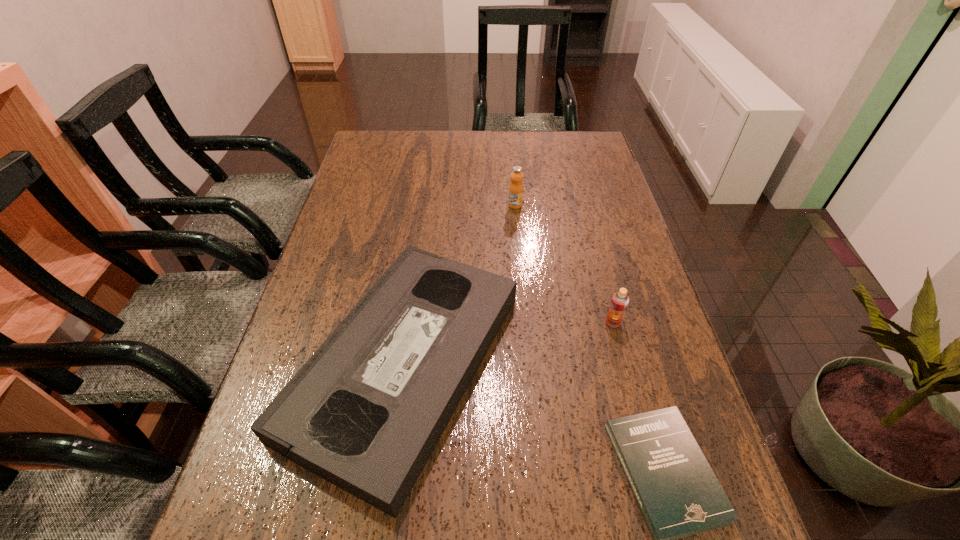
You are a GUI agent. You are given a task and a screenshot of the screen. Output one action in this format:
    pyautogui.click(x=<x>, y=<y>)
    Task: Click on the vacant space that satisfies the following two spatial constraints: 1. on the back side of the right orange juice; 2. on the left side of the videotape
    Image resolution: width=960 pixels, height=540 pixels.
    Given the screenshot: What is the action you would take?
    click(x=411, y=323)

Identify the location of free point that satisfies the following two spatial constraints: 1. on the front label of the nearer orange juice; 2. on the left side of the farther orange juice. The image size is (960, 540). (526, 323).